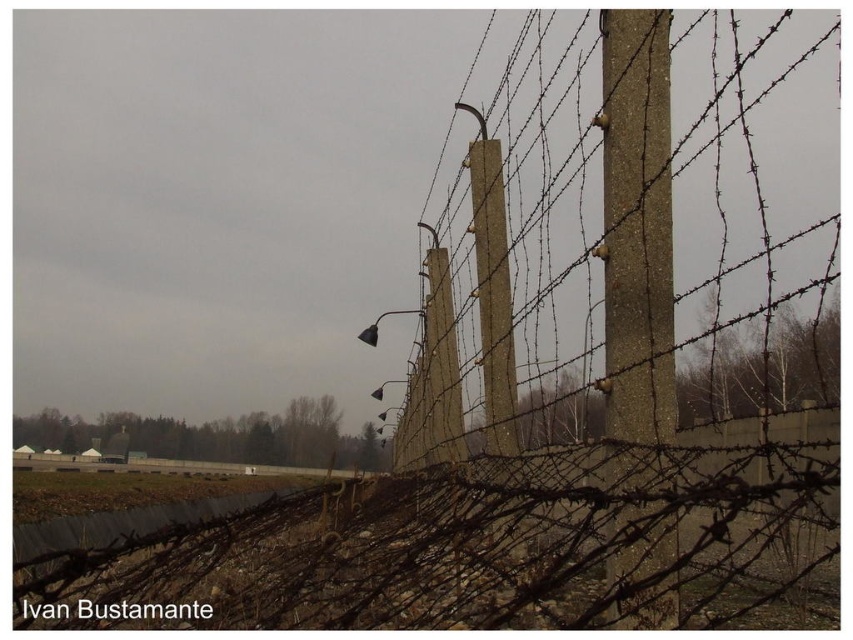
Describe the element at coordinates (612, 234) in the screenshot. This screenshot has height=640, width=853. I see `concrete wire at center` at that location.

Does point (750, 198) come farther from viewer compared to point (624, 618)?

Yes, point (750, 198) is farther from viewer.

At what (x,y) coordinates should I click in order to perform the action: click on concrete wire at center. Please return your answer as a coordinate pair (x, y). This screenshot has width=853, height=640. Looking at the image, I should click on (612, 234).

Locate an element on the screen. The height and width of the screenshot is (640, 853). concrete wire at center is located at coordinates (612, 234).